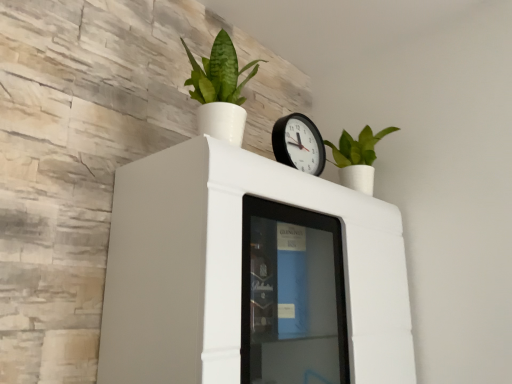
What do you see at coordinates (220, 90) in the screenshot?
I see `green matte plant at upper center, marked as the first houseplant in a front-to-back arrangement` at bounding box center [220, 90].

What is the approximate height of black plastic wall clock at upper center?

The height of black plastic wall clock at upper center is 6.78 inches.

What is the approximate height of green matte plant at upper right, the second houseplant viewed from the left?

The height of green matte plant at upper right, the second houseplant viewed from the left, is 28.26 centimeters.

You are a GUI agent. You are given a task and a screenshot of the screen. Output one action in this format:
    pyautogui.click(x=<x>, y=<y>)
    Task: Click on the green matte plant at upper center, marked as the first houseplant in a front-to-back arrangement
    
    Given the screenshot: What is the action you would take?
    pyautogui.click(x=220, y=90)

Is black plastic wall clock at upper center surrounding white glossy cabinet at upper center?

No, white glossy cabinet at upper center is not a part of black plastic wall clock at upper center.

Which is behind, black plastic wall clock at upper center or white glossy cabinet at upper center?

black plastic wall clock at upper center.

From a real-world perspective, is black plastic wall clock at upper center over white glossy cabinet at upper center?

Indeed, from a real-world perspective, black plastic wall clock at upper center stands above white glossy cabinet at upper center.

Is black plastic wall clock at upper center turned away from white glossy cabinet at upper center?

No, black plastic wall clock at upper center is not facing the opposite direction of white glossy cabinet at upper center.

What's the angular difference between green matte plant at upper right, placed as the first houseplant when sorted from back to front, and black plastic wall clock at upper center's facing directions?

They differ by 0.00257 degrees in their facing directions.

Can you confirm if green matte plant at upper right, positioned as the second houseplant in front-to-back order, is shorter than black plastic wall clock at upper center?

No, green matte plant at upper right, positioned as the second houseplant in front-to-back order, is not shorter than black plastic wall clock at upper center.

Image resolution: width=512 pixels, height=384 pixels. I want to click on wall clock located in front of the green matte plant at upper right, positioned as the second houseplant in front-to-back order, so point(298,144).

Does green matte plant at upper right, placed as the first houseplant when sorted from back to front, have a lesser width compared to black plastic wall clock at upper center?

Incorrect, the width of green matte plant at upper right, placed as the first houseplant when sorted from back to front, is not less than that of black plastic wall clock at upper center.

Can you confirm if green matte plant at upper center, which ranks as the second houseplant in back-to-front order, is thinner than green matte plant at upper right, the second houseplant viewed from the left?

No.

Where is `houseplant on the right of the green matte plant at upper center, marked as the first houseplant in a front-to-back arrangement`? houseplant on the right of the green matte plant at upper center, marked as the first houseplant in a front-to-back arrangement is located at coordinates click(357, 158).

In terms of height, does green matte plant at upper center, which ranks as the second houseplant in back-to-front order, look taller or shorter compared to green matte plant at upper right, which is the first houseplant in right-to-left order?

green matte plant at upper center, which ranks as the second houseplant in back-to-front order, is taller than green matte plant at upper right, which is the first houseplant in right-to-left order.

Is green matte plant at upper center, marked as the first houseplant in a front-to-back arrangement, positioned with its back to green matte plant at upper right, placed as the first houseplant when sorted from back to front?

That's not correct — green matte plant at upper center, marked as the first houseplant in a front-to-back arrangement, is not looking away from green matte plant at upper right, placed as the first houseplant when sorted from back to front.

Is white glossy cabinet at upper center taller or shorter than green matte plant at upper center, marked as the 1th houseplant in a left-to-right arrangement?

Considering their sizes, white glossy cabinet at upper center has more height than green matte plant at upper center, marked as the 1th houseplant in a left-to-right arrangement.

Would you say white glossy cabinet at upper center contains green matte plant at upper center, placed as the 2th houseplant when sorted from right to left?

No, white glossy cabinet at upper center does not contain green matte plant at upper center, placed as the 2th houseplant when sorted from right to left.

Is white glossy cabinet at upper center turned away from green matte plant at upper center, placed as the 2th houseplant when sorted from right to left?

No, white glossy cabinet at upper center is not facing the opposite direction of green matte plant at upper center, placed as the 2th houseplant when sorted from right to left.

Is the position of white glossy cabinet at upper center more distant than that of green matte plant at upper center, marked as the first houseplant in a front-to-back arrangement?

No, white glossy cabinet at upper center is closer to the camera.

Is black plastic wall clock at upper center closer to camera compared to green matte plant at upper center, which ranks as the second houseplant in back-to-front order?

No.

Considering the relative sizes of black plastic wall clock at upper center and green matte plant at upper center, which ranks as the second houseplant in back-to-front order, in the image provided, is black plastic wall clock at upper center thinner than green matte plant at upper center, which ranks as the second houseplant in back-to-front order,?

Indeed, black plastic wall clock at upper center has a lesser width compared to green matte plant at upper center, which ranks as the second houseplant in back-to-front order.

Is black plastic wall clock at upper center inside or outside of green matte plant at upper center, placed as the 2th houseplant when sorted from right to left?

black plastic wall clock at upper center cannot be found inside green matte plant at upper center, placed as the 2th houseplant when sorted from right to left.

Is green matte plant at upper center, placed as the 2th houseplant when sorted from right to left, placed right next to white glossy cabinet at upper center?

They are not placed beside each other.

From the image's perspective, would you say green matte plant at upper center, placed as the 2th houseplant when sorted from right to left, is positioned over white glossy cabinet at upper center?

Yes, from the image's perspective, green matte plant at upper center, placed as the 2th houseplant when sorted from right to left, is above white glossy cabinet at upper center.

Choose the correct answer: Is green matte plant at upper center, marked as the first houseplant in a front-to-back arrangement, inside white glossy cabinet at upper center or outside it?

green matte plant at upper center, marked as the first houseplant in a front-to-back arrangement, exists outside the volume of white glossy cabinet at upper center.

Is green matte plant at upper center, marked as the first houseplant in a front-to-back arrangement, wider or thinner than white glossy cabinet at upper center?

In the image, green matte plant at upper center, marked as the first houseplant in a front-to-back arrangement, appears to be more narrow than white glossy cabinet at upper center.

How many degrees apart are the facing directions of white glossy cabinet at upper center and black plastic wall clock at upper center?

The facing directions of white glossy cabinet at upper center and black plastic wall clock at upper center are 0.000485 degrees apart.

From a real-world perspective, is white glossy cabinet at upper center physically above black plastic wall clock at upper center?

No.

Is white glossy cabinet at upper center next to black plastic wall clock at upper center?

white glossy cabinet at upper center is not next to black plastic wall clock at upper center, and they're not touching.

From the image's perspective, does white glossy cabinet at upper center appear higher than black plastic wall clock at upper center?

No, from the image's perspective, white glossy cabinet at upper center is not above black plastic wall clock at upper center.

This screenshot has height=384, width=512. In order to click on furniture on the left of the black plastic wall clock at upper center in this screenshot , I will do `click(250, 275)`.

The image size is (512, 384). I want to click on wall clock in front of the green matte plant at upper right, which is the first houseplant in right-to-left order, so click(298, 144).

From the image, which object appears to be farther from white glossy cabinet at upper center, green matte plant at upper center, marked as the 1th houseplant in a left-to-right arrangement, or green matte plant at upper right, which is the first houseplant in right-to-left order?

Based on the image, green matte plant at upper right, which is the first houseplant in right-to-left order, appears to be further to white glossy cabinet at upper center.

Based on their spatial positions, is green matte plant at upper right, the second houseplant viewed from the left, or white glossy cabinet at upper center further from green matte plant at upper center, marked as the first houseplant in a front-to-back arrangement?

Based on the image, green matte plant at upper right, the second houseplant viewed from the left, appears to be further to green matte plant at upper center, marked as the first houseplant in a front-to-back arrangement.

Based on their spatial positions, is green matte plant at upper right, placed as the first houseplant when sorted from back to front, or green matte plant at upper center, marked as the 1th houseplant in a left-to-right arrangement, further from white glossy cabinet at upper center?

green matte plant at upper right, placed as the first houseplant when sorted from back to front.

From the image, which object appears to be farther from green matte plant at upper right, the second houseplant viewed from the left, white glossy cabinet at upper center or green matte plant at upper center, placed as the 2th houseplant when sorted from right to left?

The object further to green matte plant at upper right, the second houseplant viewed from the left, is green matte plant at upper center, placed as the 2th houseplant when sorted from right to left.

Based on their spatial positions, is black plastic wall clock at upper center or white glossy cabinet at upper center closer to green matte plant at upper center, which ranks as the second houseplant in back-to-front order?

black plastic wall clock at upper center is positioned closer to the anchor green matte plant at upper center, which ranks as the second houseplant in back-to-front order.

Estimate the real-world distances between objects in this image. Which object is closer to white glossy cabinet at upper center, green matte plant at upper center, marked as the 1th houseplant in a left-to-right arrangement, or black plastic wall clock at upper center?

Among the two, black plastic wall clock at upper center is located nearer to white glossy cabinet at upper center.

Looking at the image, which one is located closer to black plastic wall clock at upper center, white glossy cabinet at upper center or green matte plant at upper center, marked as the first houseplant in a front-to-back arrangement?

The object closer to black plastic wall clock at upper center is green matte plant at upper center, marked as the first houseplant in a front-to-back arrangement.

From the image, which object appears to be nearer to black plastic wall clock at upper center, green matte plant at upper center, which ranks as the second houseplant in back-to-front order, or white glossy cabinet at upper center?

green matte plant at upper center, which ranks as the second houseplant in back-to-front order, is positioned closer to the anchor black plastic wall clock at upper center.

Find the location of a particular element. This screenshot has height=384, width=512. houseplant located between white glossy cabinet at upper center and green matte plant at upper right, which is the first houseplant in right-to-left order, in the depth direction is located at coordinates (220, 90).

Where is `wall clock located between green matte plant at upper center, marked as the 1th houseplant in a left-to-right arrangement, and green matte plant at upper right, placed as the first houseplant when sorted from back to front, in the left-right direction`? wall clock located between green matte plant at upper center, marked as the 1th houseplant in a left-to-right arrangement, and green matte plant at upper right, placed as the first houseplant when sorted from back to front, in the left-right direction is located at coordinates pos(298,144).

You are a GUI agent. You are given a task and a screenshot of the screen. Output one action in this format:
    pyautogui.click(x=<x>, y=<y>)
    Task: Click on the wall clock between white glossy cabinet at upper center and green matte plant at upper right, placed as the first houseplant when sorted from back to front, from front to back
    This screenshot has height=384, width=512.
    Given the screenshot: What is the action you would take?
    pyautogui.click(x=298, y=144)

You are a GUI agent. You are given a task and a screenshot of the screen. Output one action in this format:
    pyautogui.click(x=<x>, y=<y>)
    Task: Click on the wall clock between green matte plant at upper center, marked as the first houseplant in a front-to-back arrangement, and white glossy cabinet at upper center from top to bottom
    The image size is (512, 384).
    Given the screenshot: What is the action you would take?
    pyautogui.click(x=298, y=144)